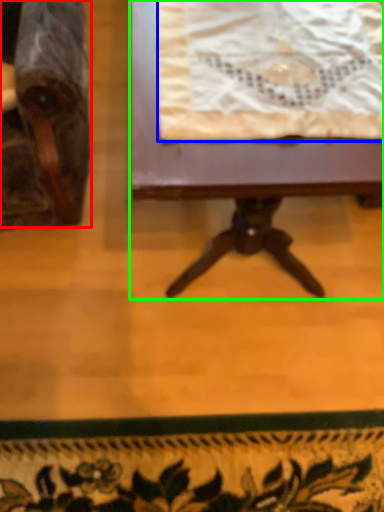
Question: Considering the real-world distances, which object is farthest from chair (highlighted by a red box)? blanket (highlighted by a blue box) or table (highlighted by a green box)?

Choices:
 (A) blanket
 (B) table

Answer: (A)